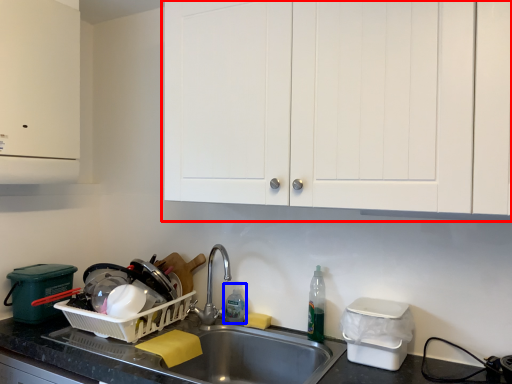
Question: Which object is further to the camera taking this photo, cabinetry (highlighted by a red box) or bottle (highlighted by a blue box)?

Choices:
 (A) cabinetry
 (B) bottle

Answer: (B)